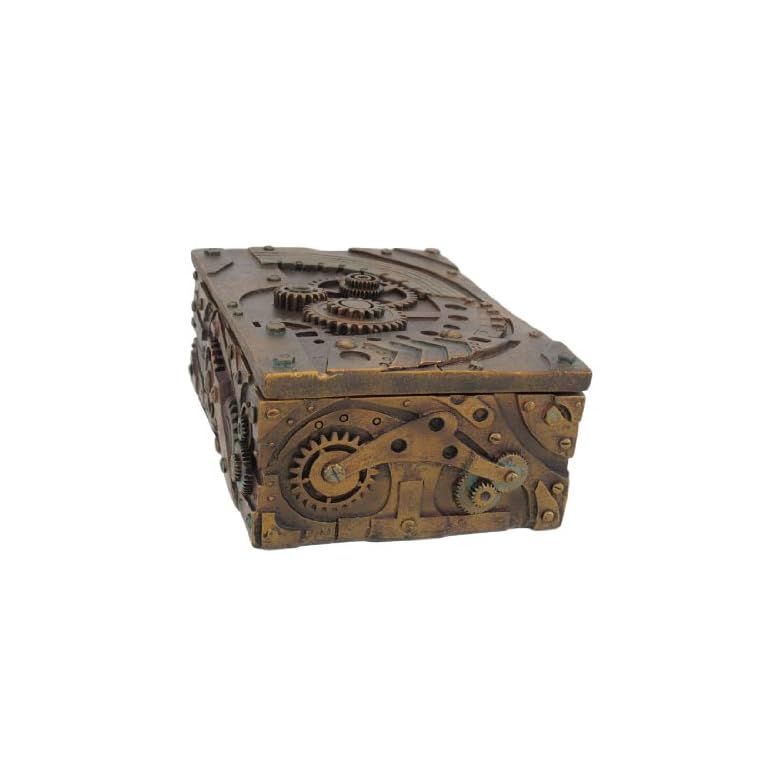
I want to click on box, so click(x=442, y=438).